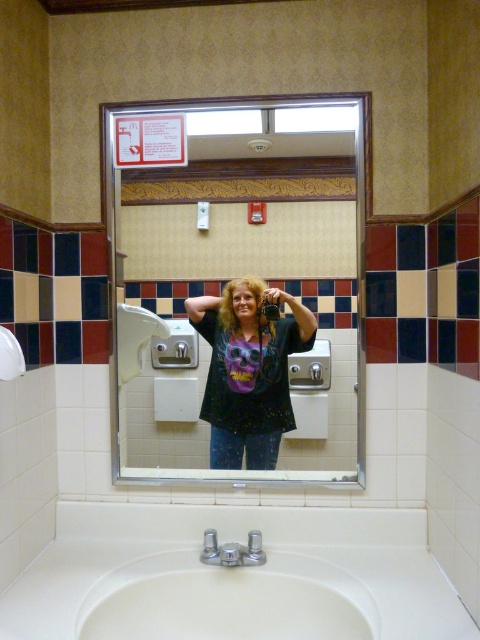
In the bathroom scene, you see a clear glass mirror at upper center and a white glossy sink at lower center. From the perspective of someone standing in front of the sink, which object is positioned to the right?

The clear glass mirror at upper center is positioned to the right of the white glossy sink at lower center.